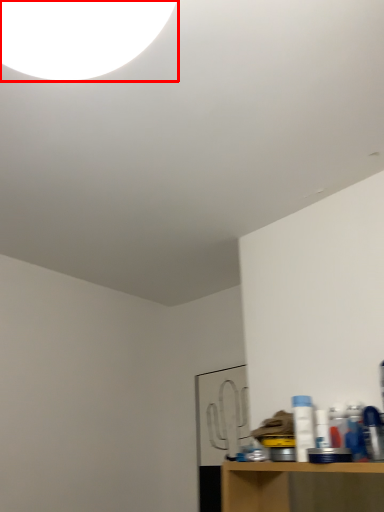
Question: Considering the relative positions of light (annotated by the red box) and bottle in the image provided, where is light (annotated by the red box) located with respect to the staircase?

Choices:
 (A) left
 (B) right

Answer: (A)